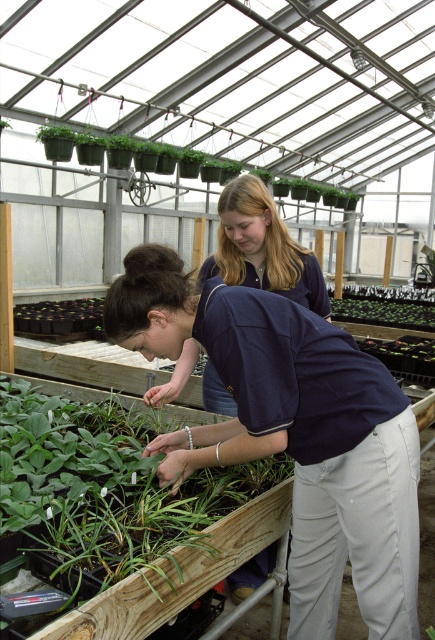
Question: Which is nearer to the green matte hanging plants at upper center?

Choices:
 (A) green leafy plant at center
 (B) dark blue shirt at center

Answer: (A)

Question: Among these points, which one is nearest to the camera?

Choices:
 (A) (224, 252)
 (B) (267, 472)
 (C) (267, 170)
 (D) (200, 429)

Answer: (D)

Question: Does dark blue shirt at center appear on the left side of blue cotton shirt at center?

Choices:
 (A) yes
 (B) no

Answer: (B)

Question: Is green leafy plant at center closer to the viewer compared to green matte hanging plants at upper center?

Choices:
 (A) yes
 (B) no

Answer: (A)

Question: Which point appears closest to the camera in this image?

Choices:
 (A) (89, 132)
 (B) (360, 305)
 (C) (160, 509)

Answer: (C)

Question: Does dark blue shirt at center appear over green leafy plant at center?

Choices:
 (A) yes
 (B) no

Answer: (A)